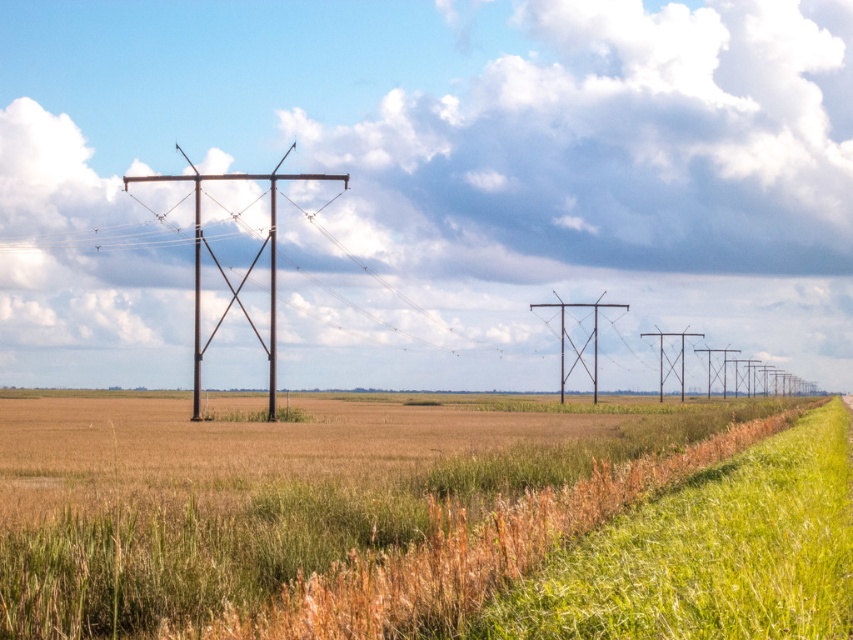
Question: Considering the relative positions of rusty metal telegraph pole at left and rusty metal telegraph pole at center in the image provided, where is rusty metal telegraph pole at left located with respect to rusty metal telegraph pole at center?

Choices:
 (A) below
 (B) above

Answer: (B)

Question: Among these points, which one is farthest from the camera?

Choices:
 (A) (163, 176)
 (B) (595, 358)

Answer: (A)

Question: Which object is farther from the camera taking this photo?

Choices:
 (A) brown grassy wheat field at center
 (B) rusty metal telegraph pole at left
 (C) rusty metal telegraph pole at center

Answer: (C)

Question: Which point is farther to the camera?

Choices:
 (A) (97, 426)
 (B) (270, 344)

Answer: (B)

Question: Where is brown grassy wheat field at center located in relation to rusty metal telegraph pole at center in the image?

Choices:
 (A) left
 (B) right

Answer: (A)

Question: Does brown grassy wheat field at center have a larger size compared to rusty metal telegraph pole at left?

Choices:
 (A) yes
 (B) no

Answer: (B)